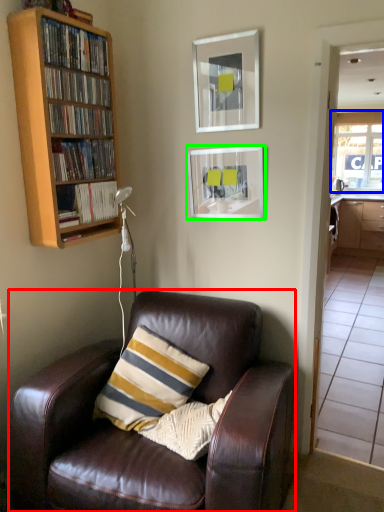
Question: Which object is the farthest from chair (highlighted by a red box)? Choose among these: window (highlighted by a blue box) or picture frame (highlighted by a green box).

Choices:
 (A) window
 (B) picture frame

Answer: (A)